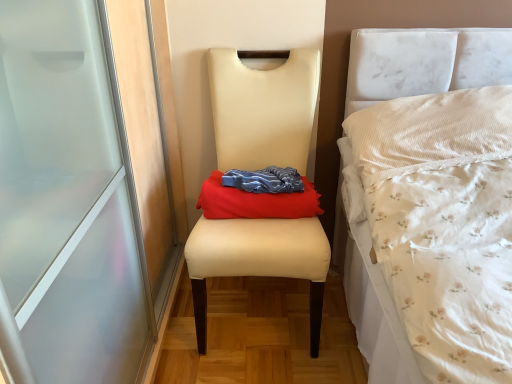
Image resolution: width=512 pixels, height=384 pixels. I want to click on vacant space in matte cream chair at center (from a real-world perspective), so click(265, 308).